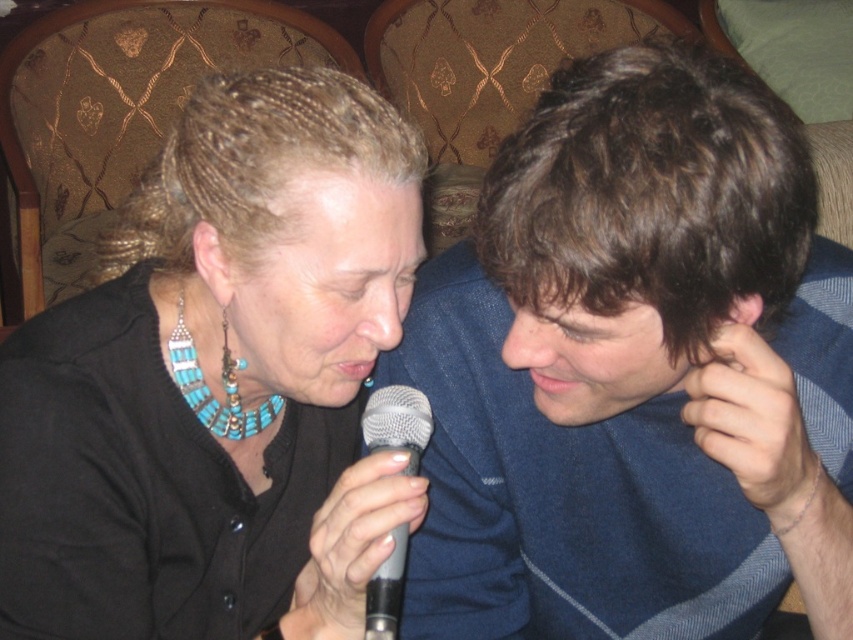
Question: Among these points, which one is farthest from the camera?

Choices:
 (A) (386, 410)
 (B) (758, 220)

Answer: (A)

Question: Can you confirm if turquoise beaded necklace at center is thinner than silver metallic microphone at center?

Choices:
 (A) no
 (B) yes

Answer: (A)

Question: From the image, what is the correct spatial relationship of turquoise beaded necklace at center in relation to silver metallic microphone at center?

Choices:
 (A) right
 (B) left

Answer: (B)

Question: Can you confirm if blue knit sweater at center is positioned above silver metallic microphone at center?

Choices:
 (A) no
 (B) yes

Answer: (B)

Question: Which object is the closest to the silver metallic microphone at center?

Choices:
 (A) turquoise beaded necklace at center
 (B) blue knit sweater at center

Answer: (A)

Question: Considering the real-world distances, which object is closest to the silver metallic microphone at center?

Choices:
 (A) blue knit sweater at center
 (B) turquoise beaded necklace at center

Answer: (B)